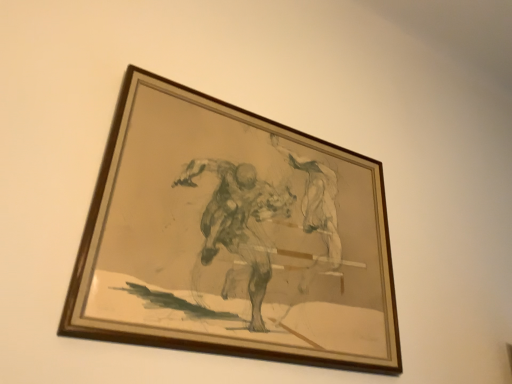
Question: Should I look upward or downward to see brown wooden picture frame at upper center?

Choices:
 (A) up
 (B) down

Answer: (B)